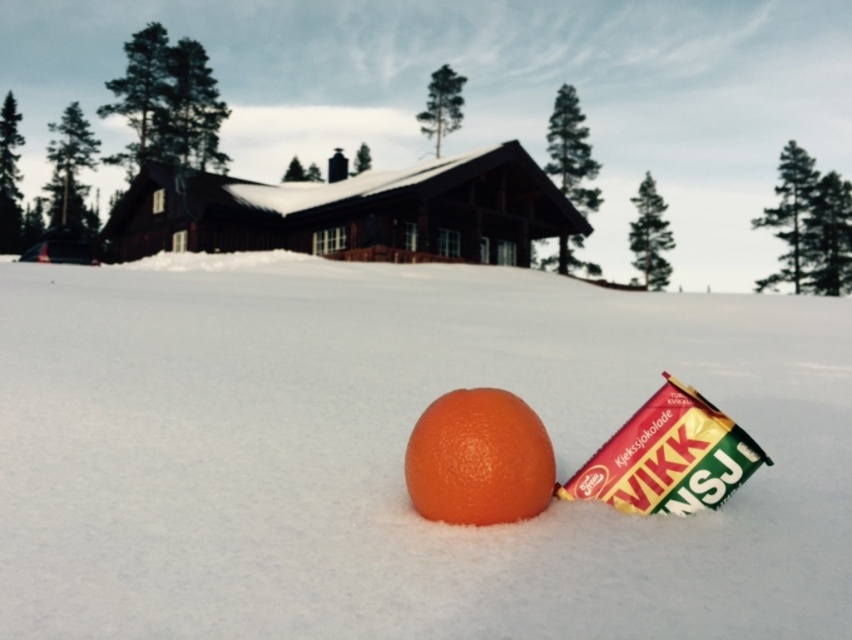
Which is above, white fluffy snow at center or orange matte at center?

white fluffy snow at center

Describe the element at coordinates (395, 452) in the screenshot. I see `white fluffy snow at center` at that location.

Where is `white fluffy snow at center`? white fluffy snow at center is located at coordinates (395, 452).